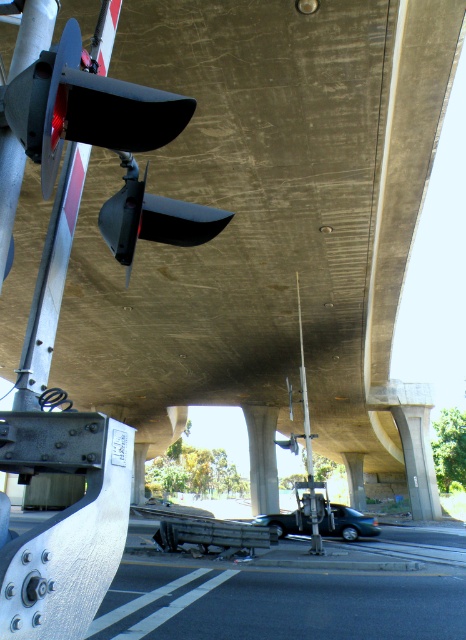
Is brushed metal highway at lower center behind concrete at center?

No, it is not.

Between brushed metal highway at lower center and concrete at center, which one appears on the right side from the viewer's perspective?

From the viewer's perspective, concrete at center appears more on the right side.

Is point (368, 628) positioned in front of point (275, 422)?

Yes, it is in front of point (275, 422).

Locate an element on the screen. The width and height of the screenshot is (466, 640). brushed metal highway at lower center is located at coordinates (289, 589).

The image size is (466, 640). I want to click on brushed metal highway at lower center, so click(x=289, y=589).

Which is in front, point (186, 604) or point (179, 209)?

Point (179, 209) is in front.

Identify the location of brushed metal highway at lower center. This screenshot has width=466, height=640. (289, 589).

Is matte black traffic light at center positioned before metallic silver pole at center?

Yes, matte black traffic light at center is closer to the viewer.

Is matte black traffic light at center further to camera compared to metallic silver pole at center?

No.

Where is `matte black traffic light at center`? This screenshot has width=466, height=640. matte black traffic light at center is located at coordinates (152, 218).